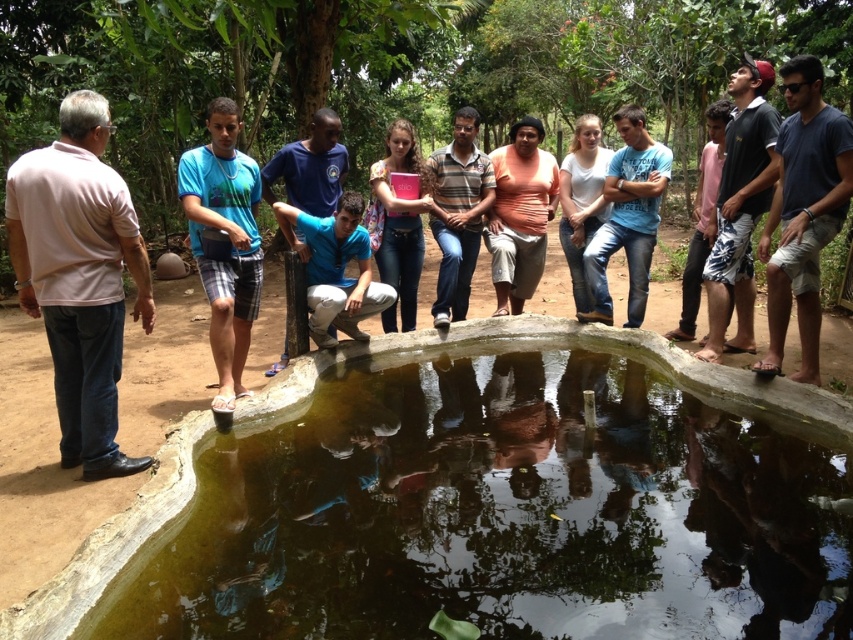
You are a photographer standing on the dirt path by the pond. You want to take a photo that includes both the blue cotton shirt at center and the pink matte book at center. Given that your camera has a maximum focus range of 20 inches, will both objects be in focus?

The distance between the blue cotton shirt at center and the pink matte book at center is 20.67 inches, which exceeds the camera maximum focus range of 20 inches. Therefore, both objects will not be in focus simultaneously.

Where is the striped cotton shirt at center located in the image?

The striped cotton shirt at center is located at point 0.334 on the horizontal axis and 0.538 on the vertical axis.

You are part of the group standing on the dirt path around the pond. You see both the blue cotton shirt at center and the pink matte book at center. Which object is positioned lower from the ground?

The blue cotton shirt at center is below the pink matte book at center, so the blue cotton shirt at center is positioned lower from the ground.